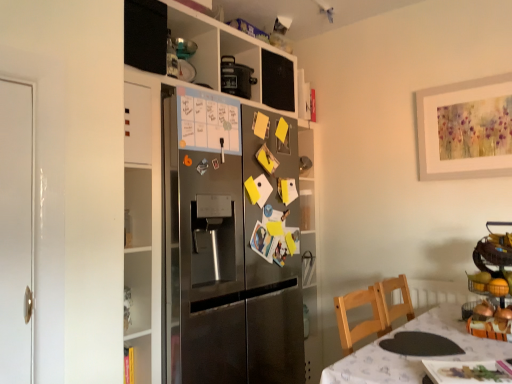
Question: Considering the relative sizes of white fabric table at lower right and stainless steel refrigerator at center in the image provided, is white fabric table at lower right smaller than stainless steel refrigerator at center?

Choices:
 (A) yes
 (B) no

Answer: (A)

Question: Is white fabric table at lower right at the left side of stainless steel refrigerator at center?

Choices:
 (A) no
 (B) yes

Answer: (A)

Question: Is white fabric table at lower right turned away from stainless steel refrigerator at center?

Choices:
 (A) no
 (B) yes

Answer: (A)

Question: Is stainless steel refrigerator at center completely or partially inside white fabric table at lower right?

Choices:
 (A) no
 (B) yes

Answer: (A)

Question: Does white fabric table at lower right have a lesser height compared to stainless steel refrigerator at center?

Choices:
 (A) no
 (B) yes

Answer: (B)

Question: Could you tell me if white fabric table at lower right is facing stainless steel refrigerator at center?

Choices:
 (A) no
 (B) yes

Answer: (A)

Question: Does orange matte fruit basket at right contain white fabric table at lower right?

Choices:
 (A) yes
 (B) no

Answer: (B)

Question: Is orange matte fruit basket at right at the right side of white fabric table at lower right?

Choices:
 (A) no
 (B) yes

Answer: (B)

Question: From the image's perspective, is orange matte fruit basket at right on top of white fabric table at lower right?

Choices:
 (A) yes
 (B) no

Answer: (A)

Question: Does orange matte fruit basket at right have a greater width compared to white fabric table at lower right?

Choices:
 (A) no
 (B) yes

Answer: (A)

Question: Does orange matte fruit basket at right come behind white fabric table at lower right?

Choices:
 (A) no
 (B) yes

Answer: (B)

Question: Is orange matte fruit basket at right aimed at white fabric table at lower right?

Choices:
 (A) no
 (B) yes

Answer: (A)

Question: Does metallic fruit basket at right lie in front of stainless steel refrigerator at center?

Choices:
 (A) yes
 (B) no

Answer: (A)